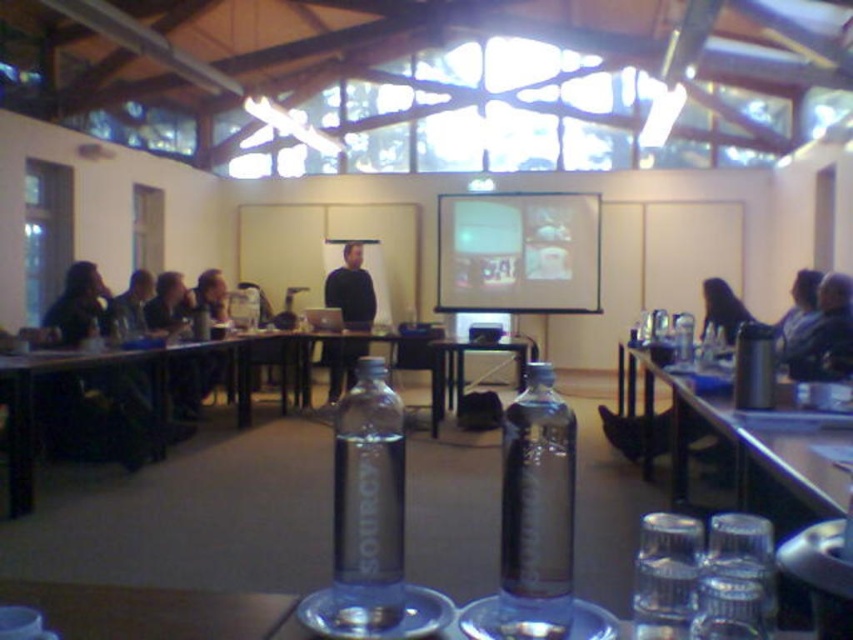
You are sitting at the conference table and want to reach both the clear plastic water bottle at center and the blue fabric shirt at upper right. Which object is closer to you?

The clear plastic water bottle at center is closer to you because it is further to the viewer than the blue fabric shirt at upper right.

You are sitting at the table in the conference room and want to reach for the clear plastic water bottle at center to take a sip. However, you notice the blue fabric shirt at upper right is in your line of sight. In which direction should you move your hand to grab the bottle without moving your head?

The clear plastic water bottle at center is to the left of the blue fabric shirt at upper right. To grab the bottle without moving your head, you should move your hand to the left of the blue fabric shirt at upper right.